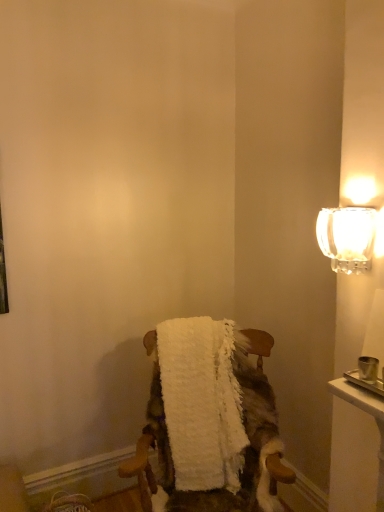
Question: Does clear glass sconce at upper right appear on the left side of white fluffy blanket at center?

Choices:
 (A) no
 (B) yes

Answer: (A)

Question: Is clear glass sconce at upper right closer to the viewer compared to white fluffy blanket at center?

Choices:
 (A) yes
 (B) no

Answer: (A)

Question: Is clear glass sconce at upper right wider than white fluffy blanket at center?

Choices:
 (A) no
 (B) yes

Answer: (A)

Question: From a real-world perspective, is clear glass sconce at upper right located beneath white fluffy blanket at center?

Choices:
 (A) no
 (B) yes

Answer: (A)

Question: Can you confirm if clear glass sconce at upper right is taller than white fluffy blanket at center?

Choices:
 (A) yes
 (B) no

Answer: (B)

Question: Considering the relative sizes of clear glass sconce at upper right and white fluffy blanket at center in the image provided, is clear glass sconce at upper right bigger than white fluffy blanket at center?

Choices:
 (A) yes
 (B) no

Answer: (B)

Question: Can you confirm if white fluffy bath towel at center is wider than clear glass sconce at upper right?

Choices:
 (A) yes
 (B) no

Answer: (A)

Question: Considering the relative sizes of white fluffy bath towel at center and clear glass sconce at upper right in the image provided, is white fluffy bath towel at center bigger than clear glass sconce at upper right?

Choices:
 (A) yes
 (B) no

Answer: (A)

Question: Can you confirm if white fluffy bath towel at center is thinner than clear glass sconce at upper right?

Choices:
 (A) no
 (B) yes

Answer: (A)

Question: Would you say clear glass sconce at upper right is part of white fluffy bath towel at center's contents?

Choices:
 (A) no
 (B) yes

Answer: (A)

Question: Would you say white fluffy bath towel at center is a long distance from clear glass sconce at upper right?

Choices:
 (A) no
 (B) yes

Answer: (A)

Question: Is white fluffy bath towel at center to the left of clear glass sconce at upper right from the viewer's perspective?

Choices:
 (A) yes
 (B) no

Answer: (A)

Question: Considering the relative sizes of white fluffy blanket at center and white fluffy bath towel at center in the image provided, is white fluffy blanket at center wider than white fluffy bath towel at center?

Choices:
 (A) yes
 (B) no

Answer: (A)